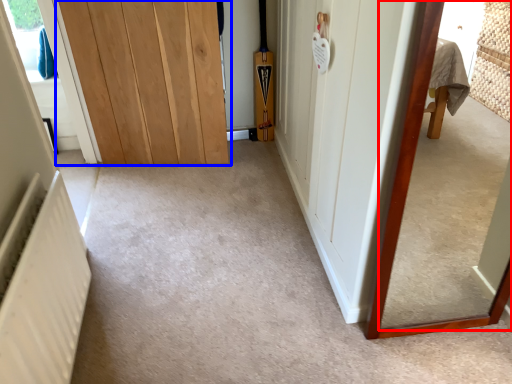
Question: Which object is closer to the camera taking this photo, mirror (highlighted by a red box) or door (highlighted by a blue box)?

Choices:
 (A) mirror
 (B) door

Answer: (A)